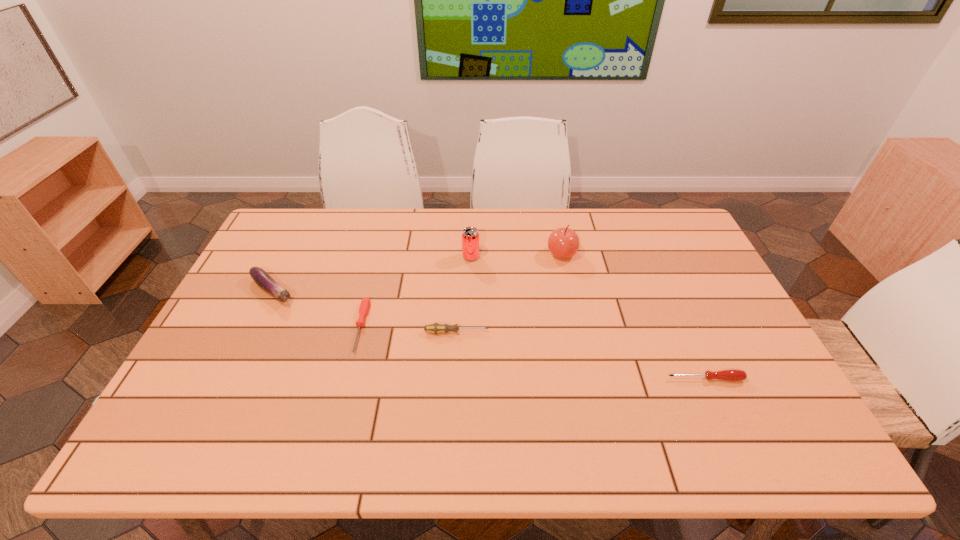
You are a GUI agent. You are given a task and a screenshot of the screen. Output one action in this format:
    pyautogui.click(x=<x>, y=<y>)
    Task: Click on the vacant space that satisfies the following two spatial constraints: 1. at the tip of the second screwdriver from left to right; 2. on the back side of the nearest object
    
    Given the screenshot: What is the action you would take?
    pyautogui.click(x=454, y=379)